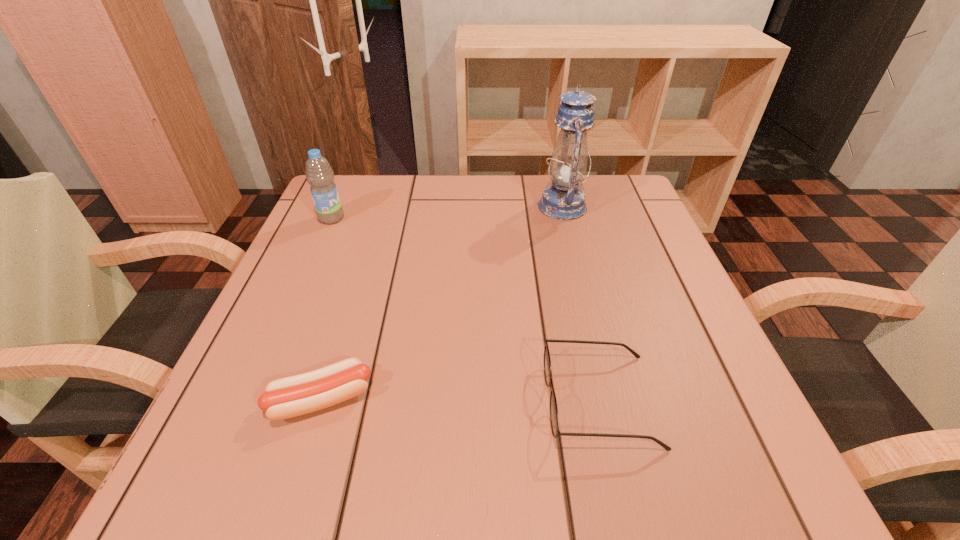
Image resolution: width=960 pixels, height=540 pixels. What are the coordinates of `object present at the far right corner` in the screenshot? It's located at (563, 200).

Locate an element on the screen. The image size is (960, 540). object that is at the near right corner is located at coordinates (554, 418).

The height and width of the screenshot is (540, 960). I want to click on vacant area at the far edge, so click(x=466, y=198).

The height and width of the screenshot is (540, 960). In order to click on vacant region at the near edge of the desktop in this screenshot , I will do `click(531, 433)`.

In the image, there is a desktop. Identify the location of vacant area at the left edge. Image resolution: width=960 pixels, height=540 pixels. (349, 259).

In order to click on vacant space at the right edge of the desktop in this screenshot , I will do `click(655, 259)`.

Find the location of `vacant region at the near left corner of the desktop`. vacant region at the near left corner of the desktop is located at coordinates (213, 464).

I want to click on free area in between the shortest object and the spectacles, so click(x=461, y=400).

Where is `vacant area that lies between the spectacles and the lantern`? vacant area that lies between the spectacles and the lantern is located at coordinates tap(581, 303).

You are a GUI agent. You are given a task and a screenshot of the screen. Output one action in this format:
    pyautogui.click(x=<x>, y=<y>)
    Task: Click on the free point between the third shortest object and the third tallest object
    The height and width of the screenshot is (540, 960).
    Given the screenshot: What is the action you would take?
    pyautogui.click(x=466, y=309)